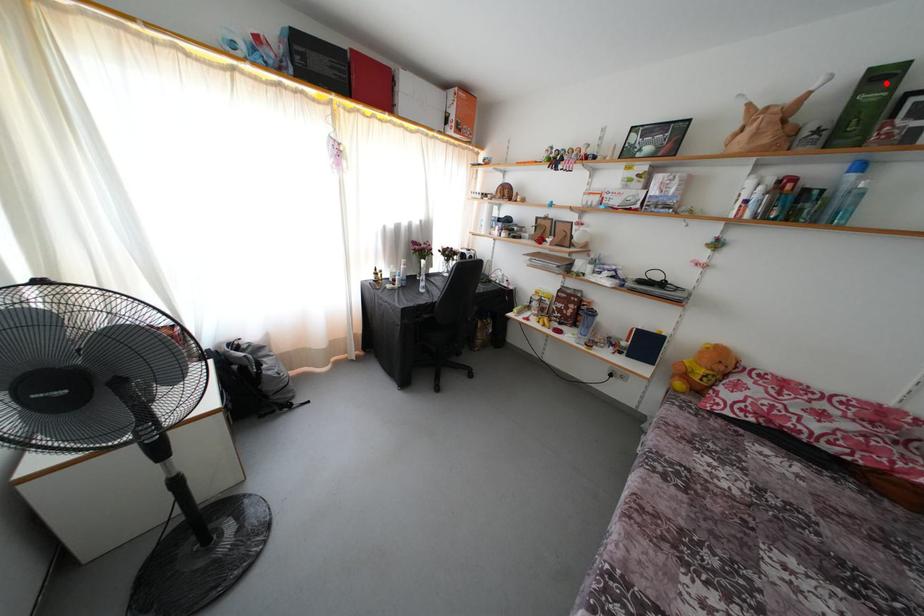
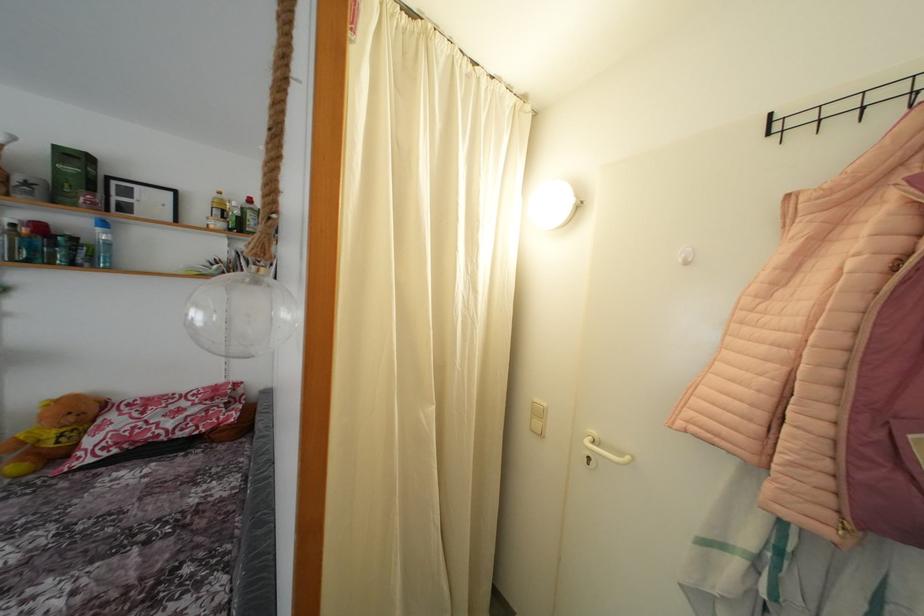
Where in the second image is the point corresponding to the highlighted location from the first image?

(80, 163)